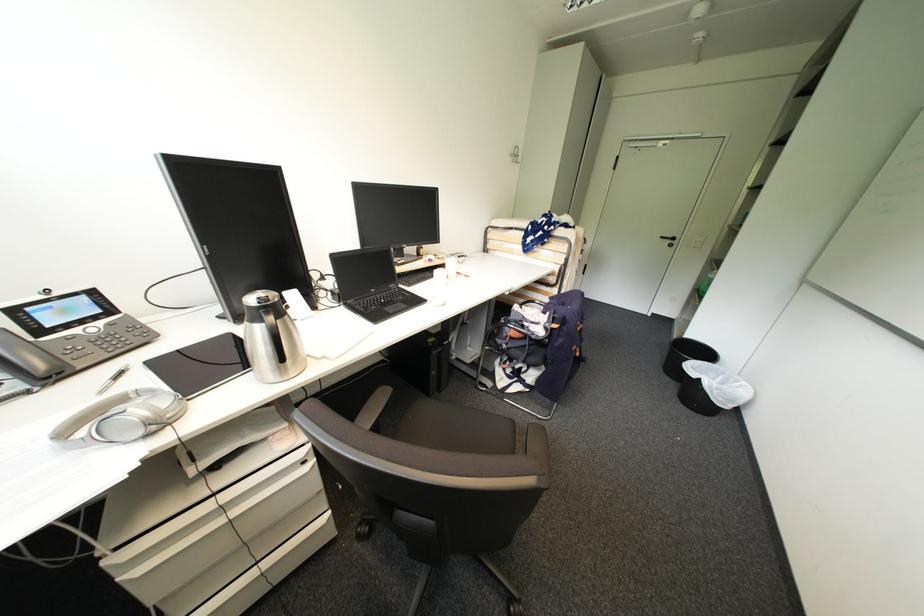
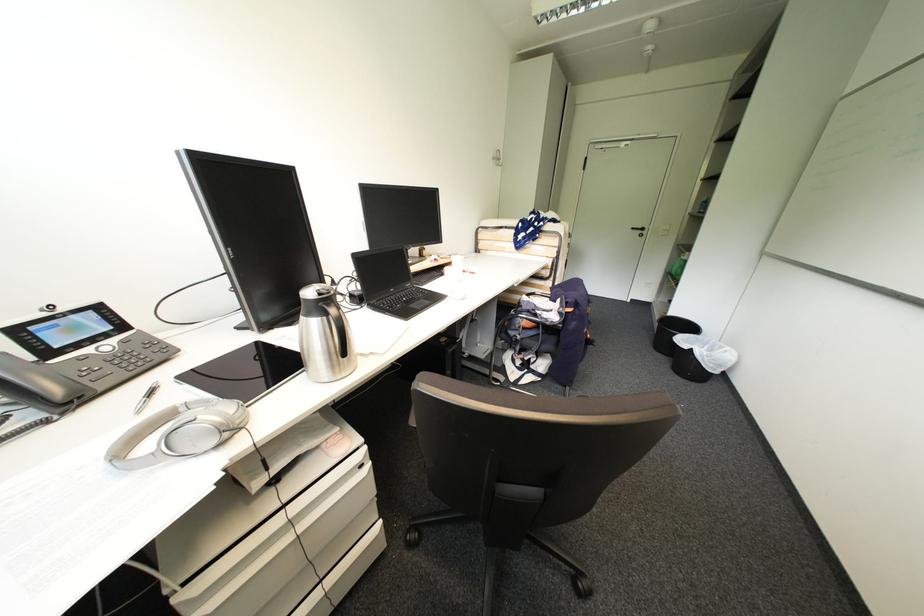
Question: I am providing you with two images of the same scene from different viewpoints. After the viewpoint changes to image2, which objects are now occluded?

Choices:
 (A) phone handset
 (B) silver headphones
 (C) thermos handle
 (D) none of these

Answer: (D)